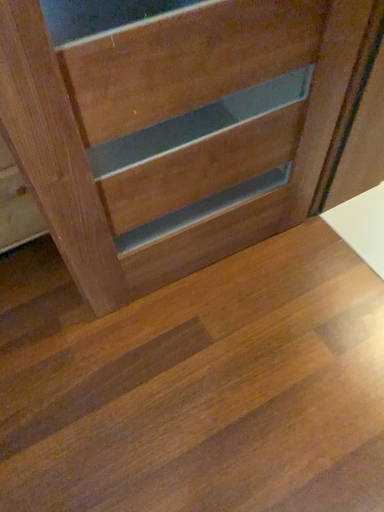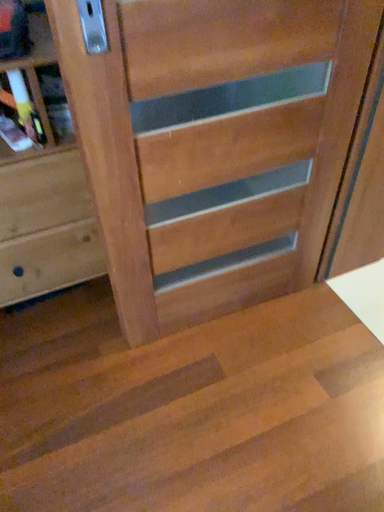
Question: Which way did the camera rotate in the video?

Choices:
 (A) rotated upward
 (B) rotated downward

Answer: (A)